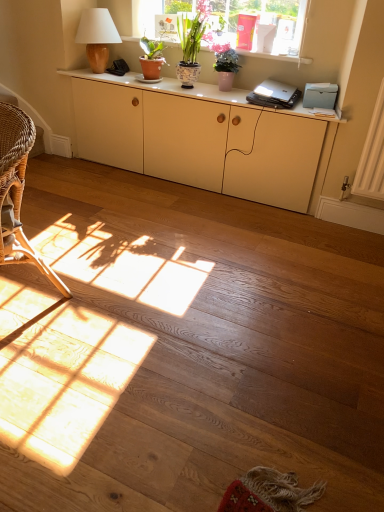
Question: Can you confirm if matte terracotta pot at upper center, the first houseplant viewed from the left, is taller than matte cream cabinet at center?

Choices:
 (A) no
 (B) yes

Answer: (A)

Question: Can you confirm if matte terracotta pot at upper center, positioned as the 3th houseplant in right-to-left order, is thinner than matte cream cabinet at center?

Choices:
 (A) yes
 (B) no

Answer: (A)

Question: From a real-world perspective, is matte terracotta pot at upper center, the first houseplant viewed from the left, physically below matte cream cabinet at center?

Choices:
 (A) no
 (B) yes

Answer: (A)

Question: Is matte terracotta pot at upper center, the first houseplant viewed from the left, oriented towards matte cream cabinet at center?

Choices:
 (A) yes
 (B) no

Answer: (B)

Question: Is point (302, 114) closer or farther from the camera than point (157, 62)?

Choices:
 (A) farther
 (B) closer

Answer: (B)

Question: From the image's perspective, is matte white cabinet at upper center located above or below matte terracotta pot at upper center, positioned as the 3th houseplant in right-to-left order?

Choices:
 (A) below
 (B) above

Answer: (A)

Question: Is matte white cabinet at upper center bigger or smaller than matte terracotta pot at upper center, positioned as the 3th houseplant in right-to-left order?

Choices:
 (A) big
 (B) small

Answer: (A)

Question: Would you say matte white cabinet at upper center is inside or outside matte terracotta pot at upper center, positioned as the 3th houseplant in right-to-left order?

Choices:
 (A) outside
 (B) inside

Answer: (A)

Question: In the image, is matte ceramic pots at upper center positioned in front of or behind pink ceramic vase at upper center, the third houseplant in the left-to-right sequence?

Choices:
 (A) front
 (B) behind

Answer: (B)

Question: From the image's perspective, is matte ceramic pots at upper center positioned above or below pink ceramic vase at upper center, the third houseplant in the left-to-right sequence?

Choices:
 (A) above
 (B) below

Answer: (A)

Question: In the image, is matte ceramic pots at upper center on the left side or the right side of pink ceramic vase at upper center, which is the first houseplant from right to left?

Choices:
 (A) right
 (B) left

Answer: (B)

Question: In terms of width, does matte ceramic pots at upper center look wider or thinner when compared to pink ceramic vase at upper center, the third houseplant in the left-to-right sequence?

Choices:
 (A) thin
 (B) wide

Answer: (B)

Question: Considering the positions of black plastic laptop at center and matte wood lamp at upper left in the image, is black plastic laptop at center taller or shorter than matte wood lamp at upper left?

Choices:
 (A) short
 (B) tall

Answer: (A)

Question: Looking at their shapes, would you say black plastic laptop at center is wider or thinner than matte wood lamp at upper left?

Choices:
 (A) thin
 (B) wide

Answer: (B)